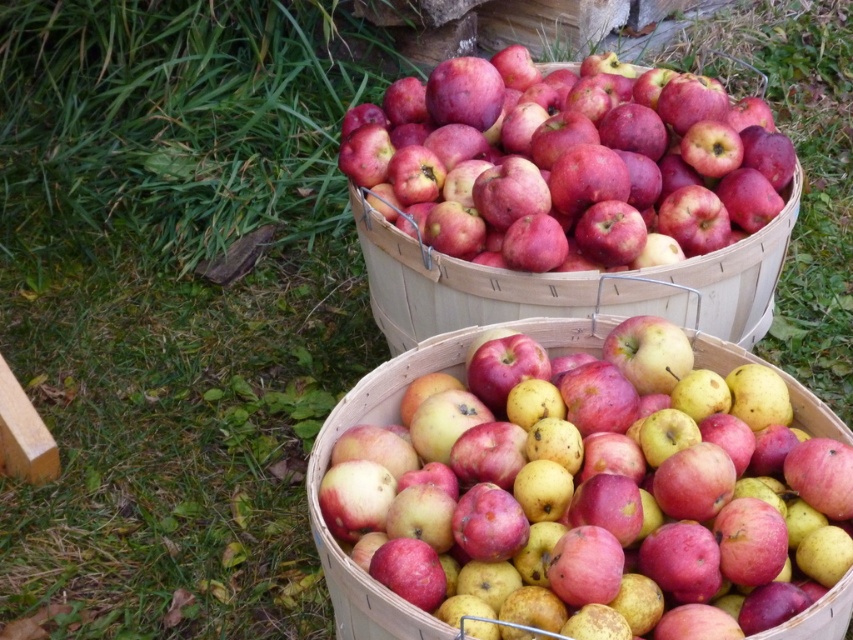
Question: Among these objects, which one is farthest from the camera?

Choices:
 (A) shiny red apples at upper center
 (B) shiny red apples at center

Answer: (A)

Question: Does shiny red apples at upper center appear on the right side of shiny red apples at center?

Choices:
 (A) yes
 (B) no

Answer: (A)

Question: Can you confirm if shiny red apples at upper center is bigger than shiny red apples at center?

Choices:
 (A) no
 (B) yes

Answer: (B)

Question: Which point is farther from the camera taking this photo?

Choices:
 (A) (407, 605)
 (B) (718, 243)

Answer: (B)

Question: Can you confirm if shiny red apples at upper center is positioned below shiny red apples at center?

Choices:
 (A) no
 (B) yes

Answer: (A)